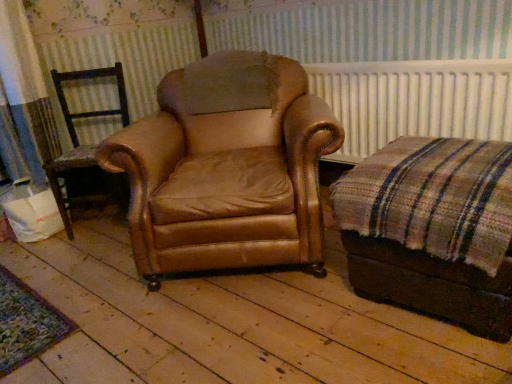
Question: Considering the relative sizes of brown leather chair at left, which is counted as the 2th chair, starting from the right, and plaid fabric ottoman at right in the image provided, is brown leather chair at left, which is counted as the 2th chair, starting from the right, thinner than plaid fabric ottoman at right?

Choices:
 (A) yes
 (B) no

Answer: (A)

Question: Is brown leather chair at left, which appears as the 1th chair when viewed from the left, far away from plaid fabric ottoman at right?

Choices:
 (A) yes
 (B) no

Answer: (A)

Question: Is brown leather chair at left, which appears as the 1th chair when viewed from the left, bigger than plaid fabric ottoman at right?

Choices:
 (A) no
 (B) yes

Answer: (A)

Question: From a real-world perspective, is brown leather chair at left, which is counted as the 2th chair, starting from the right, physically below plaid fabric ottoman at right?

Choices:
 (A) no
 (B) yes

Answer: (A)

Question: Does brown leather chair at left, which is counted as the 2th chair, starting from the right, have a greater height compared to plaid fabric ottoman at right?

Choices:
 (A) yes
 (B) no

Answer: (A)

Question: Does brown leather chair at left, which is counted as the 2th chair, starting from the right, have a lesser height compared to plaid fabric ottoman at right?

Choices:
 (A) yes
 (B) no

Answer: (B)

Question: Considering the relative sizes of white radiator at upper center and brown leather chair at left, which appears as the 1th chair when viewed from the left, in the image provided, is white radiator at upper center wider than brown leather chair at left, which appears as the 1th chair when viewed from the left,?

Choices:
 (A) no
 (B) yes

Answer: (A)

Question: From the image's perspective, is white radiator at upper center beneath brown leather chair at left, which is counted as the 2th chair, starting from the right?

Choices:
 (A) no
 (B) yes

Answer: (A)

Question: From a real-world perspective, is white radiator at upper center below brown leather chair at left, which is counted as the 2th chair, starting from the right?

Choices:
 (A) yes
 (B) no

Answer: (B)

Question: Can you confirm if white radiator at upper center is positioned to the left of brown leather chair at left, which appears as the 1th chair when viewed from the left?

Choices:
 (A) yes
 (B) no

Answer: (B)

Question: Is white radiator at upper center thinner than brown leather chair at left, which appears as the 1th chair when viewed from the left?

Choices:
 (A) yes
 (B) no

Answer: (A)

Question: Can you confirm if white radiator at upper center is smaller than brown leather chair at left, which is counted as the 2th chair, starting from the right?

Choices:
 (A) no
 (B) yes

Answer: (B)

Question: Is the position of plaid fabric ottoman at right less distant than that of brown leather chair at left, which is counted as the 2th chair, starting from the right?

Choices:
 (A) no
 (B) yes

Answer: (B)